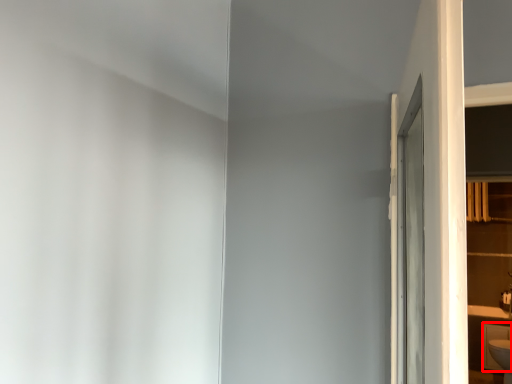
Question: From the image, what is the correct spatial relationship of cabinetry (annotated by the red box) in relation to shelf?

Choices:
 (A) right
 (B) left

Answer: (A)